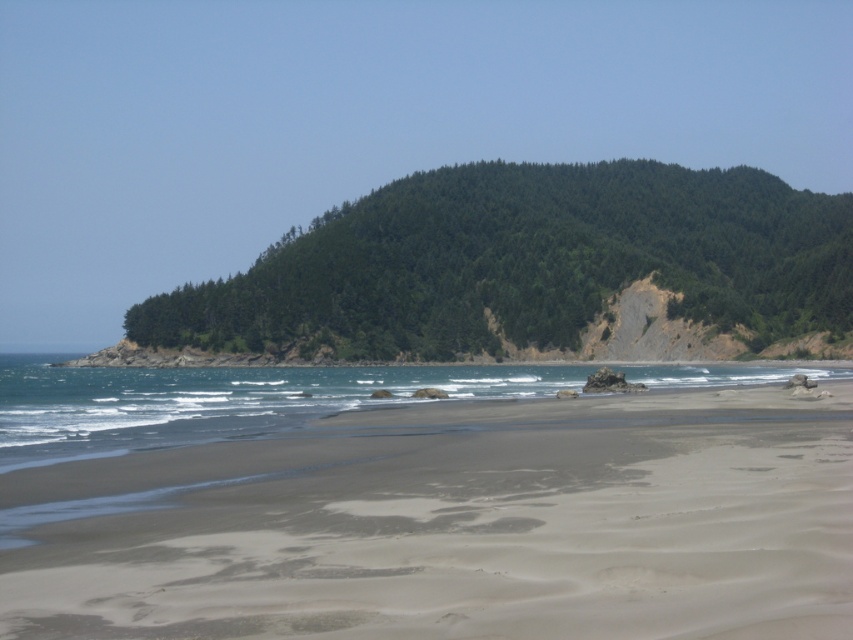
You are a photographer planning to capture the sandy beach at lower center and the clear blue water at lower center in a single frame. Based on their sizes in the image, which one should you focus on to ensure it takes up more space in your photo?

The clear blue water at lower center should be focused on because it is larger than the sandy beach at lower center in the image.

You are standing on the sandy beach at lower center and want to reach the clear blue water at lower center. Which direction should you move to get to the water?

The sandy beach at lower center is positioned over the clear blue water at lower center, so you are already standing on the beach above the water. To reach the water, you might need to move towards the shoreline where the beach meets the water.